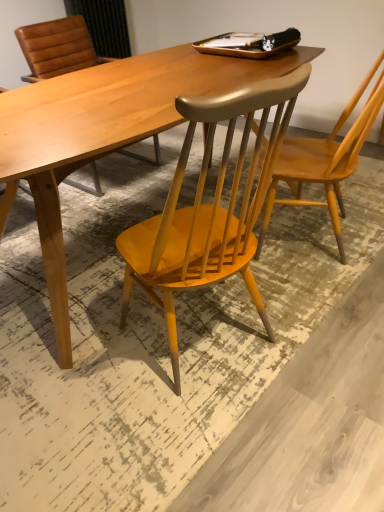
The height and width of the screenshot is (512, 384). Find the location of `wooden chair at center, which is the second chair in right-to-left order`. wooden chair at center, which is the second chair in right-to-left order is located at coordinates (209, 207).

What is the approximate width of wooden chair at center, which appears as the first chair when viewed from the left?

The width of wooden chair at center, which appears as the first chair when viewed from the left, is 36.50 inches.

The image size is (384, 512). What do you see at coordinates (209, 207) in the screenshot? I see `wooden chair at center, which appears as the first chair when viewed from the left` at bounding box center [209, 207].

What do you see at coordinates (325, 160) in the screenshot? The height and width of the screenshot is (512, 384). I see `light brown wood chair at upper right, arranged as the 1th chair when viewed from the right` at bounding box center [325, 160].

Based on the photo, measure the distance between point (307, 177) and camera.

Point (307, 177) is 1.69 meters from camera.

The image size is (384, 512). Identify the location of light brown wood chair at upper right, the second chair from the left. (325, 160).

Locate an element on the screen. Image resolution: width=384 pixels, height=512 pixels. wooden chair at center, which appears as the first chair when viewed from the left is located at coordinates (209, 207).

Which is more to the left, wooden chair at center, which appears as the first chair when viewed from the left, or light brown wood chair at upper right, arranged as the 1th chair when viewed from the right?

From the viewer's perspective, wooden chair at center, which appears as the first chair when viewed from the left, appears more on the left side.

Which object is closer to the camera, wooden chair at center, which is the second chair in right-to-left order, or light brown wood chair at upper right, arranged as the 1th chair when viewed from the right?

wooden chair at center, which is the second chair in right-to-left order, is in front.

Based on the photo, which point is more forward, (225, 163) or (330, 139)?

The point (225, 163) is in front.

From the image's perspective, is wooden chair at center, which appears as the first chair when viewed from the left, beneath light brown wood chair at upper right, the second chair from the left?

Indeed, from the image's perspective, wooden chair at center, which appears as the first chair when viewed from the left, is shown beneath light brown wood chair at upper right, the second chair from the left.

From a real-world perspective, is wooden chair at center, which is the second chair in right-to-left order, physically located above or below light brown wood chair at upper right, the second chair from the left?

wooden chair at center, which is the second chair in right-to-left order, is situated lower than light brown wood chair at upper right, the second chair from the left, in the real world.

Can you confirm if wooden chair at center, which is the second chair in right-to-left order, is thinner than light brown wood chair at upper right, arranged as the 1th chair when viewed from the right?

Incorrect, the width of wooden chair at center, which is the second chair in right-to-left order, is not less than that of light brown wood chair at upper right, arranged as the 1th chair when viewed from the right.

Can you confirm if wooden chair at center, which is the second chair in right-to-left order, is taller than light brown wood chair at upper right, arranged as the 1th chair when viewed from the right?

In fact, wooden chair at center, which is the second chair in right-to-left order, may be shorter than light brown wood chair at upper right, arranged as the 1th chair when viewed from the right.

Who is smaller, wooden chair at center, which is the second chair in right-to-left order, or light brown wood chair at upper right, arranged as the 1th chair when viewed from the right?

With smaller size is light brown wood chair at upper right, arranged as the 1th chair when viewed from the right.

Is light brown wood chair at upper right, the second chair from the left, completely or partially inside wooden chair at center, which is the second chair in right-to-left order?

No, wooden chair at center, which is the second chair in right-to-left order, does not contain light brown wood chair at upper right, the second chair from the left.

Is wooden chair at center, which appears as the first chair when viewed from the left, beside light brown wood chair at upper right, arranged as the 1th chair when viewed from the right?

No, wooden chair at center, which appears as the first chair when viewed from the left, is not next to light brown wood chair at upper right, arranged as the 1th chair when viewed from the right.

Is wooden chair at center, which appears as the first chair when viewed from the left, aimed at light brown wood chair at upper right, the second chair from the left?

Yes.

Where is `chair above the wooden chair at center, which is the second chair in right-to-left order (from the image's perspective)`? This screenshot has height=512, width=384. chair above the wooden chair at center, which is the second chair in right-to-left order (from the image's perspective) is located at coordinates (325, 160).

Between light brown wood chair at upper right, arranged as the 1th chair when viewed from the right, and wooden chair at center, which is the second chair in right-to-left order, which one appears on the right side from the viewer's perspective?

light brown wood chair at upper right, arranged as the 1th chair when viewed from the right.

Which object is further away from the camera, light brown wood chair at upper right, arranged as the 1th chair when viewed from the right, or wooden chair at center, which appears as the first chair when viewed from the left?

light brown wood chair at upper right, arranged as the 1th chair when viewed from the right, is further away from the camera.

Is point (300, 183) closer or farther from the camera than point (242, 206)?

Point (300, 183) appears to be farther away from the viewer than point (242, 206).

From the image's perspective, does light brown wood chair at upper right, arranged as the 1th chair when viewed from the right, appear lower than wooden chair at center, which appears as the first chair when viewed from the left?

A: No.

From a real-world perspective, which object rests below the other?

wooden chair at center, which appears as the first chair when viewed from the left, from a real-world perspective.

Considering the sizes of objects light brown wood chair at upper right, the second chair from the left, and wooden chair at center, which appears as the first chair when viewed from the left, in the image provided, who is wider, light brown wood chair at upper right, the second chair from the left, or wooden chair at center, which appears as the first chair when viewed from the left,?

With larger width is wooden chair at center, which appears as the first chair when viewed from the left.

Considering the sizes of objects light brown wood chair at upper right, arranged as the 1th chair when viewed from the right, and wooden chair at center, which appears as the first chair when viewed from the left, in the image provided, who is shorter, light brown wood chair at upper right, arranged as the 1th chair when viewed from the right, or wooden chair at center, which appears as the first chair when viewed from the left,?

Standing shorter between the two is wooden chair at center, which appears as the first chair when viewed from the left.

Does light brown wood chair at upper right, arranged as the 1th chair when viewed from the right, have a smaller size compared to wooden chair at center, which appears as the first chair when viewed from the left?

Correct, light brown wood chair at upper right, arranged as the 1th chair when viewed from the right, occupies less space than wooden chair at center, which appears as the first chair when viewed from the left.

Would you say light brown wood chair at upper right, arranged as the 1th chair when viewed from the right, is inside or outside wooden chair at center, which is the second chair in right-to-left order?

light brown wood chair at upper right, arranged as the 1th chair when viewed from the right, cannot be found inside wooden chair at center, which is the second chair in right-to-left order.

Are light brown wood chair at upper right, the second chair from the left, and wooden chair at center, which is the second chair in right-to-left order, located far from each other?

No.

Is light brown wood chair at upper right, the second chair from the left, turned away from wooden chair at center, which is the second chair in right-to-left order?

No, light brown wood chair at upper right, the second chair from the left,'s orientation is not away from wooden chair at center, which is the second chair in right-to-left order.

This screenshot has width=384, height=512. I want to click on chair that is behind the wooden chair at center, which appears as the first chair when viewed from the left, so click(325, 160).

Where is `chair that appears below the light brown wood chair at upper right, the second chair from the left (from the image's perspective)`? The width and height of the screenshot is (384, 512). chair that appears below the light brown wood chair at upper right, the second chair from the left (from the image's perspective) is located at coordinates (209, 207).

The image size is (384, 512). Find the location of `chair that appears behind the wooden chair at center, which is the second chair in right-to-left order`. chair that appears behind the wooden chair at center, which is the second chair in right-to-left order is located at coordinates (325, 160).